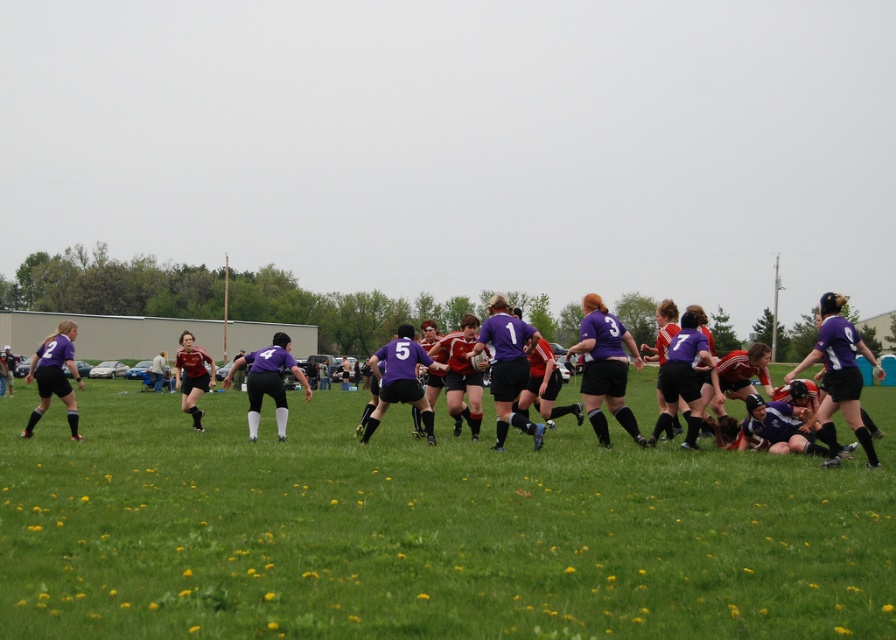
Question: Considering the relative positions of green grass at center and purple matte rugby team at center in the image provided, where is green grass at center located with respect to purple matte rugby team at center?

Choices:
 (A) right
 (B) left

Answer: (A)

Question: Is green grass at center above purple matte rugby team at center?

Choices:
 (A) no
 (B) yes

Answer: (B)

Question: Which of the following is the farthest from the observer?

Choices:
 (A) (431, 509)
 (B) (586, 592)

Answer: (A)

Question: Which of the following is the farthest from the observer?

Choices:
 (A) (32, 500)
 (B) (250, 570)

Answer: (A)

Question: Can you confirm if green grass at center is smaller than purple matte rugby team at center?

Choices:
 (A) yes
 (B) no

Answer: (A)